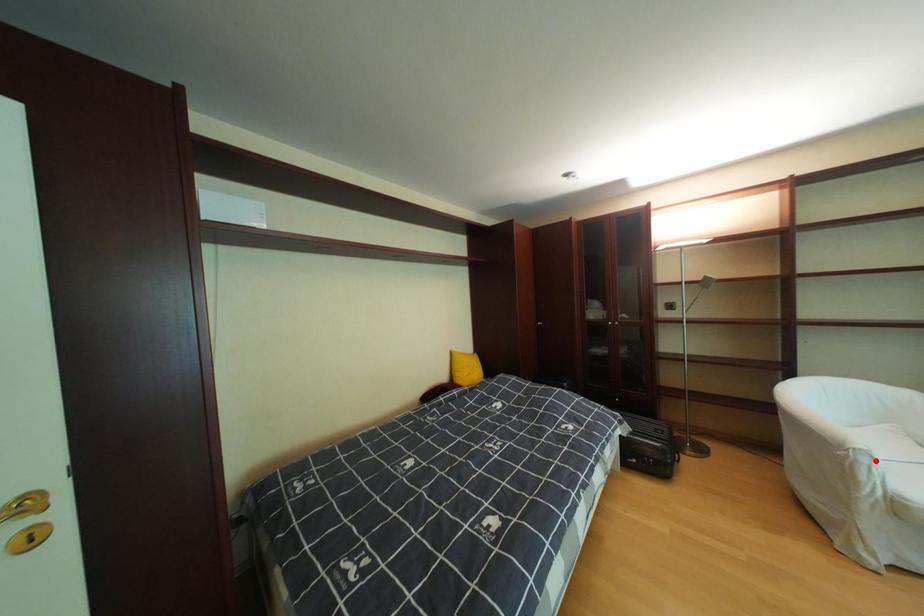
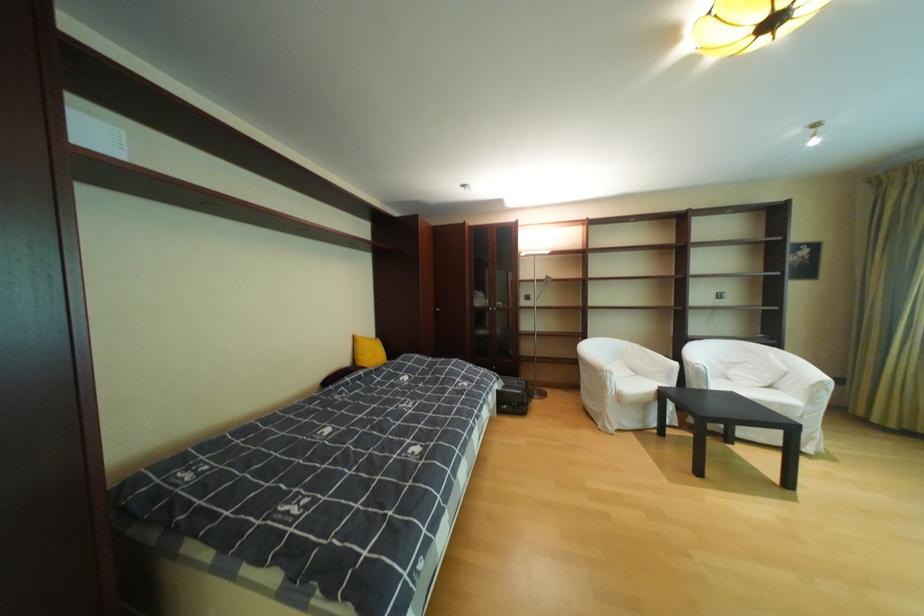
Locate, in the second image, the point that corresponds to the highlighted location in the first image.

(621, 377)